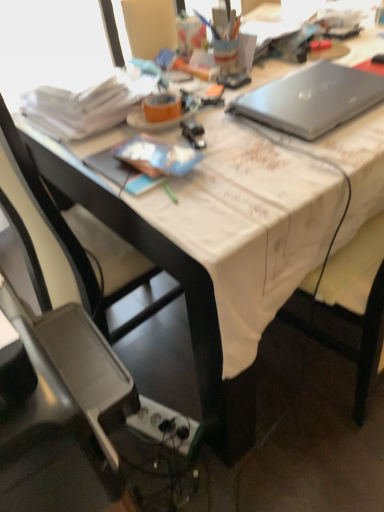
Question: From the image's perspective, is plastic gray chair at lower left, arranged as the first chair when viewed from the front, under white plastic power outlet at lower center?

Choices:
 (A) no
 (B) yes

Answer: (A)

Question: Is plastic gray chair at lower left, arranged as the first chair when viewed from the front, positioned with its back to white plastic power outlet at lower center?

Choices:
 (A) no
 (B) yes

Answer: (A)

Question: From a real-world perspective, is plastic gray chair at lower left, arranged as the first chair when viewed from the front, positioned under white plastic power outlet at lower center based on gravity?

Choices:
 (A) no
 (B) yes

Answer: (A)

Question: Is plastic gray chair at lower left, the 2th chair viewed from the back, directly adjacent to white plastic power outlet at lower center?

Choices:
 (A) yes
 (B) no

Answer: (B)

Question: Is plastic gray chair at lower left, the 2th chair viewed from the back, located outside white plastic power outlet at lower center?

Choices:
 (A) yes
 (B) no

Answer: (A)

Question: Considering the relative positions of plastic gray chair at lower left, the 2th chair viewed from the back, and white plastic power outlet at lower center in the image provided, is plastic gray chair at lower left, the 2th chair viewed from the back, in front of white plastic power outlet at lower center?

Choices:
 (A) yes
 (B) no

Answer: (A)

Question: Considering the relative positions of white plastic power outlet at lower center and plastic gray chair at lower left, the 2th chair viewed from the back, in the image provided, is white plastic power outlet at lower center behind plastic gray chair at lower left, the 2th chair viewed from the back,?

Choices:
 (A) no
 (B) yes

Answer: (B)

Question: From the image's perspective, would you say white plastic power outlet at lower center is shown under plastic gray chair at lower left, arranged as the first chair when viewed from the front?

Choices:
 (A) yes
 (B) no

Answer: (A)

Question: Can you confirm if white plastic power outlet at lower center is positioned to the left of plastic gray chair at lower left, arranged as the first chair when viewed from the front?

Choices:
 (A) no
 (B) yes

Answer: (A)

Question: Is white plastic power outlet at lower center closer to camera compared to plastic gray chair at lower left, arranged as the first chair when viewed from the front?

Choices:
 (A) no
 (B) yes

Answer: (A)

Question: From a real-world perspective, does white plastic power outlet at lower center sit lower than plastic gray chair at lower left, arranged as the first chair when viewed from the front?

Choices:
 (A) no
 (B) yes

Answer: (B)

Question: Can you confirm if white plastic power outlet at lower center is positioned to the right of plastic gray chair at lower left, the 2th chair viewed from the back?

Choices:
 (A) no
 (B) yes

Answer: (B)

Question: Can you confirm if plastic gray chair at lower left, arranged as the first chair when viewed from the front, is smaller than black plastic chair at lower left, which is the first chair from back to front?

Choices:
 (A) no
 (B) yes

Answer: (B)